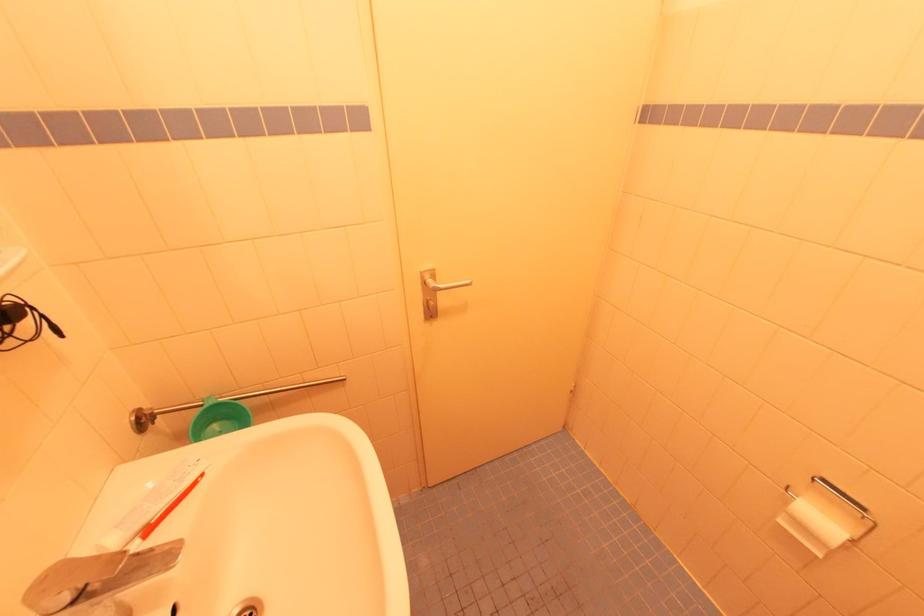
Find where to squeez the toothpaste tube. Please return your answer as a coordinate pair (x, y).

(151, 504)